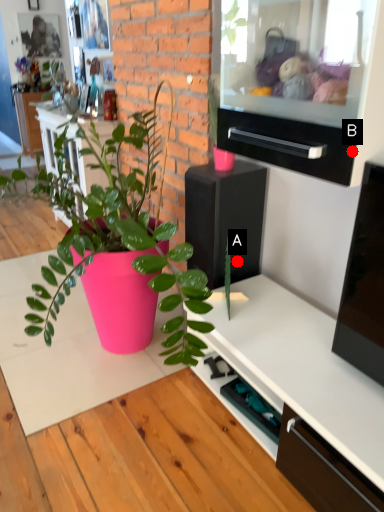
Question: Two points are circled on the image, labeled by A and B beside each circle. Among these points, which one is farthest from the camera?

Choices:
 (A) A is further
 (B) B is further

Answer: (A)